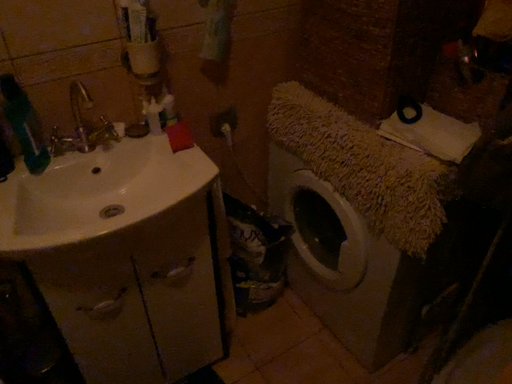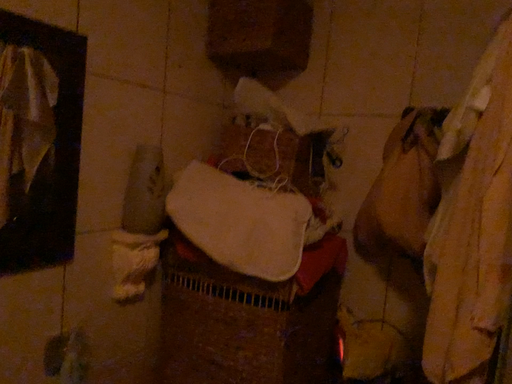
Question: How did the camera likely rotate when shooting the video?

Choices:
 (A) rotated right
 (B) rotated left

Answer: (A)